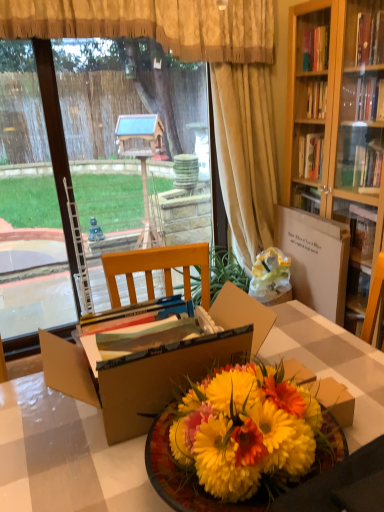
Question: Is white cardboard box at center-right taller than cardboard box at center?

Choices:
 (A) no
 (B) yes

Answer: (B)

Question: Would you say white cardboard box at center-right is outside cardboard box at center?

Choices:
 (A) no
 (B) yes

Answer: (B)

Question: Does white cardboard box at center-right have a greater width compared to cardboard box at center?

Choices:
 (A) no
 (B) yes

Answer: (A)

Question: From the image's perspective, would you say white cardboard box at center-right is positioned over cardboard box at center?

Choices:
 (A) no
 (B) yes

Answer: (B)

Question: Is the position of white cardboard box at center-right less distant than that of cardboard box at center?

Choices:
 (A) no
 (B) yes

Answer: (A)

Question: Is white cardboard box at center-right bigger than cardboard box at center?

Choices:
 (A) no
 (B) yes

Answer: (A)

Question: Does vibrant yellow petals at center have a larger size compared to beige fabric curtain at center, which is counted as the 1th curtain, starting from the right?

Choices:
 (A) yes
 (B) no

Answer: (B)

Question: Is vibrant yellow petals at center aimed at beige fabric curtain at center, the second curtain from the left?

Choices:
 (A) yes
 (B) no

Answer: (B)

Question: Is the position of vibrant yellow petals at center less distant than that of beige fabric curtain at center, the second curtain from the left?

Choices:
 (A) no
 (B) yes

Answer: (B)

Question: Is vibrant yellow petals at center outside of beige fabric curtain at center, the second curtain from the left?

Choices:
 (A) yes
 (B) no

Answer: (A)

Question: Is there a large distance between vibrant yellow petals at center and beige fabric curtain at center, the second curtain from the left?

Choices:
 (A) no
 (B) yes

Answer: (B)

Question: From the image's perspective, is vibrant yellow petals at center below beige fabric curtain at center, the second curtain from the left?

Choices:
 (A) no
 (B) yes

Answer: (B)

Question: Can you confirm if transparent glass window screen at left is positioned to the right of wooden table at center?

Choices:
 (A) no
 (B) yes

Answer: (A)